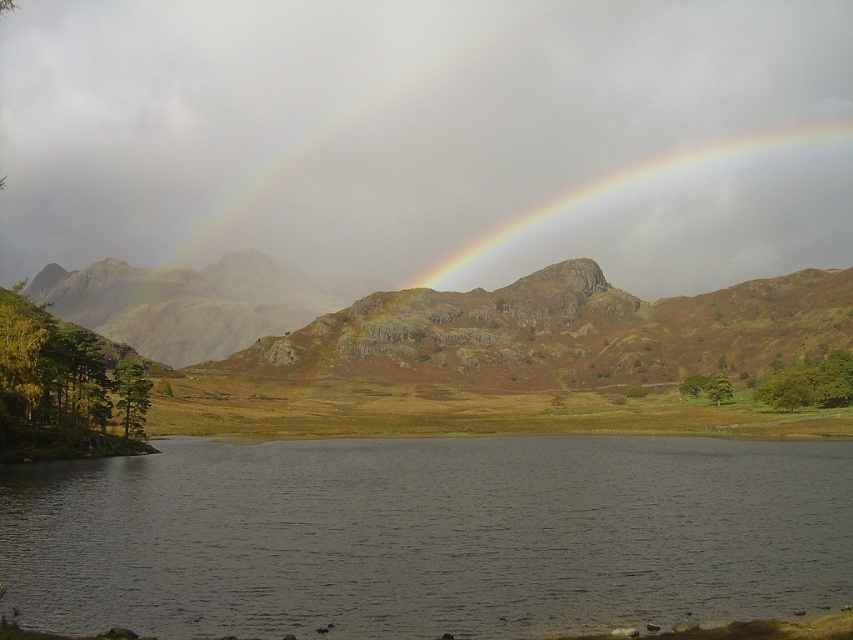
Question: Estimate the real-world distances between objects in this image. Which object is farther from the rainbow at upper center?

Choices:
 (A) rustic stone mountain at center
 (B) dark water at lower center

Answer: (B)

Question: Which of these objects is positioned closest to the dark water at lower center?

Choices:
 (A) rainbow at upper center
 (B) rustic stone mountain at center

Answer: (B)

Question: Which object is closer to the camera taking this photo?

Choices:
 (A) dark water at lower center
 (B) rustic stone mountain at center

Answer: (A)

Question: Can you confirm if rainbow at upper center is wider than rustic stone mountain at center?

Choices:
 (A) no
 (B) yes

Answer: (A)

Question: Is dark water at lower center positioned at the back of rustic stone mountain at center?

Choices:
 (A) no
 (B) yes

Answer: (A)

Question: Is dark water at lower center positioned before rustic stone mountain at center?

Choices:
 (A) yes
 (B) no

Answer: (A)